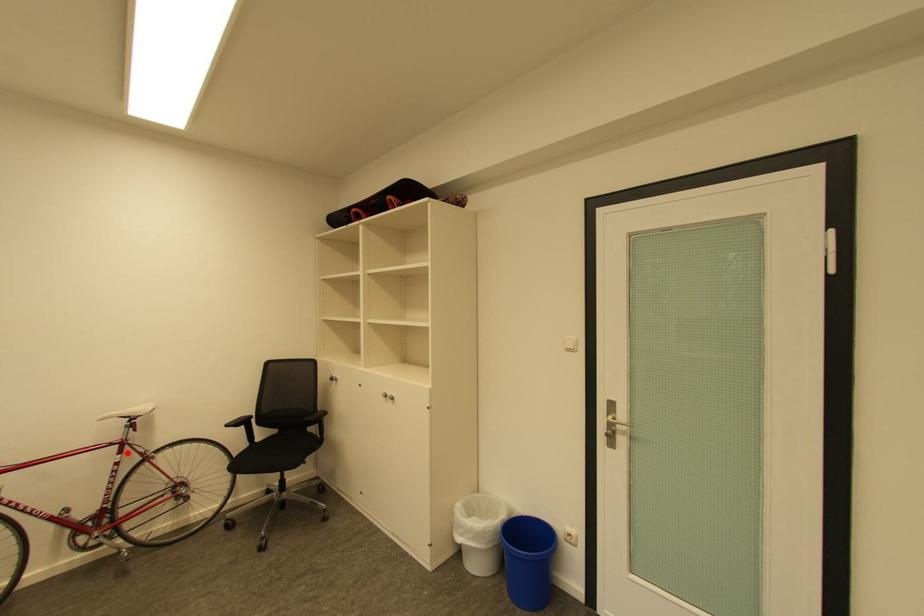
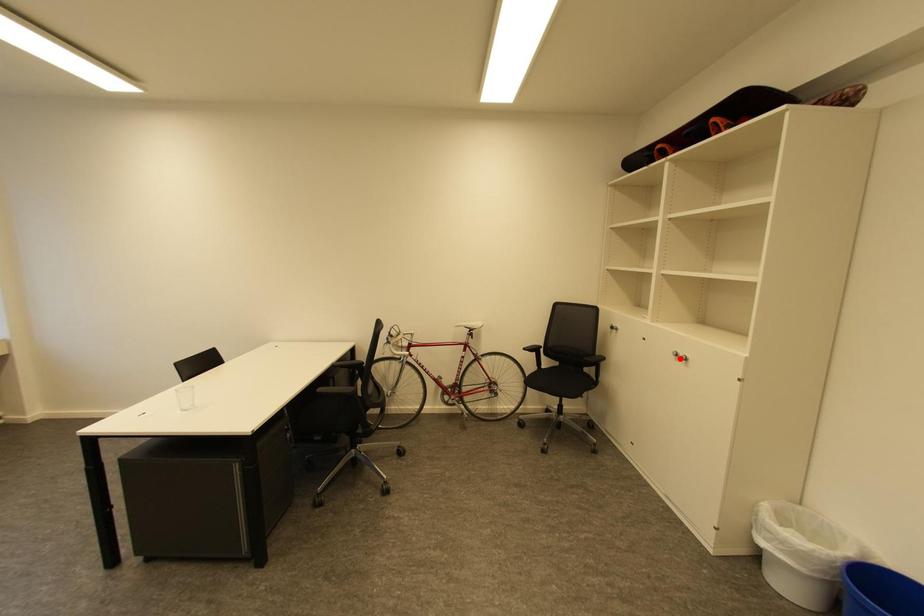
I am providing you with two images of the same scene from different viewpoints. A red point is marked on the first image and another point is marked on the second image. Is the red point in image1 aligned with the point shown in image2?

No